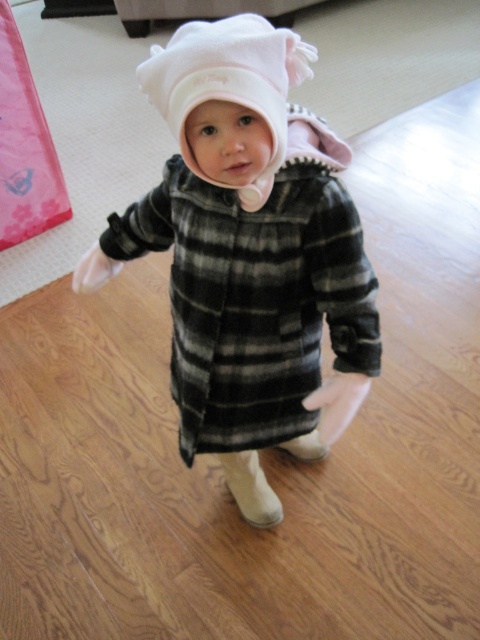
Question: Does fluffy white hat at center appear on the right side of white fleece hat at center?

Choices:
 (A) no
 (B) yes

Answer: (A)

Question: Which point is farther to the camera?

Choices:
 (A) (204, 48)
 (B) (292, 67)

Answer: (B)

Question: Is fluffy white hat at center thinner than white fleece hat at center?

Choices:
 (A) yes
 (B) no

Answer: (B)

Question: Which point is farther from the camera taking this photo?

Choices:
 (A) (271, 520)
 (B) (155, 81)

Answer: (A)

Question: Is fluffy white hat at center below white fleece hat at center?

Choices:
 (A) yes
 (B) no

Answer: (A)